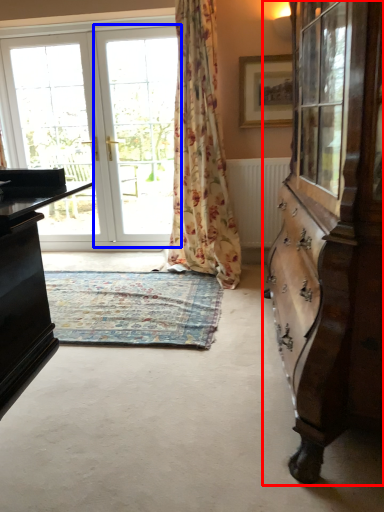
Question: Which of the following is the closest to the observer, cabinetry (highlighted by a red box) or screen door (highlighted by a blue box)?

Choices:
 (A) cabinetry
 (B) screen door

Answer: (A)